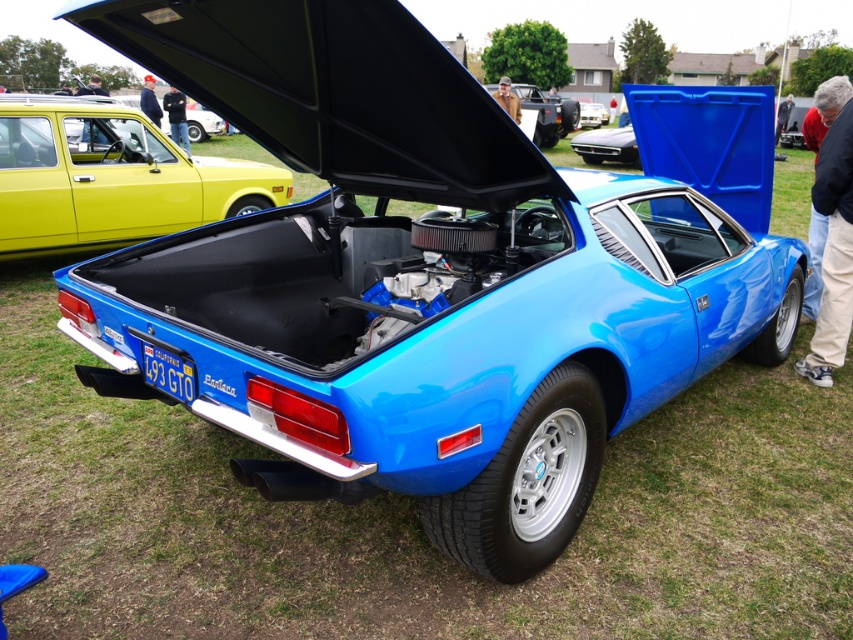
Question: Estimate the real-world distances between objects in this image. Which object is closer to the yellow matte hatchback at left?

Choices:
 (A) shiny metallic car at center
 (B) black matte hood at upper center

Answer: (B)

Question: Which object appears farthest from the camera in this image?

Choices:
 (A) black matte hood at upper center
 (B) yellow matte hatchback at left
 (C) shiny black car at center
 (D) shiny metallic car at center

Answer: (D)

Question: Is black matte hood at upper center positioned before shiny black car at center?

Choices:
 (A) no
 (B) yes

Answer: (B)

Question: Does yellow matte hatchback at left appear over shiny metallic car at center?

Choices:
 (A) no
 (B) yes

Answer: (A)

Question: Which point is closer to the camera?

Choices:
 (A) (633, 148)
 (B) (547, 140)
 (C) (451, 154)
 (D) (36, 113)

Answer: (C)

Question: Is the position of yellow matte hatchback at left more distant than that of shiny metallic car at center?

Choices:
 (A) yes
 (B) no

Answer: (B)